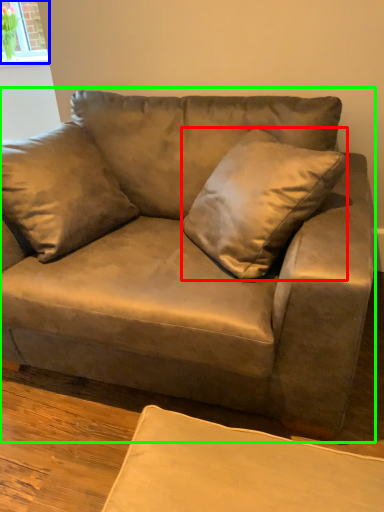
Question: Considering the real-world distances, which object is closest to throw pillow (highlighted by a red box)? window (highlighted by a blue box) or studio couch (highlighted by a green box).

Choices:
 (A) window
 (B) studio couch

Answer: (B)